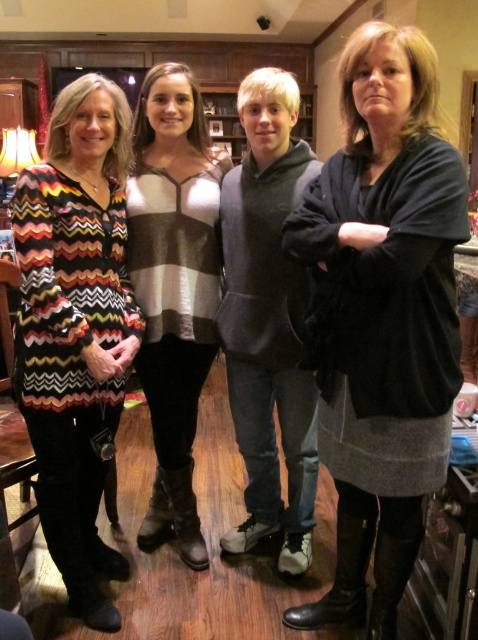
Which of these two, dark gray sweater at center or striped sweater at center, stands shorter?

With less height is dark gray sweater at center.

What do you see at coordinates (381, 316) in the screenshot?
I see `dark gray sweater at center` at bounding box center [381, 316].

This screenshot has width=478, height=640. Identify the location of dark gray sweater at center. (381, 316).

Can you confirm if dark gray sweater at center is positioned above multicolored zigzag sweater at left?

Actually, dark gray sweater at center is below multicolored zigzag sweater at left.

You are a GUI agent. You are given a task and a screenshot of the screen. Output one action in this format:
    pyautogui.click(x=<x>, y=<y>)
    Task: Click on the dark gray sweater at center
    This screenshot has width=478, height=640.
    Given the screenshot: What is the action you would take?
    pyautogui.click(x=381, y=316)

At what (x,y) coordinates should I click in order to perform the action: click on dark gray sweater at center. Please return your answer as a coordinate pair (x, y). This screenshot has width=478, height=640. Looking at the image, I should click on (381, 316).

Who is more forward, [52,186] or [184,221]?

Point [52,186] is more forward.

Is multicolored zigzag sweater at left smaller than striped sweater at center?

No.

Between point (78, 268) and point (161, 275), which one is positioned behind?

The point (161, 275) is more distant.

Identify the location of multicolored zigzag sweater at left. (76, 326).